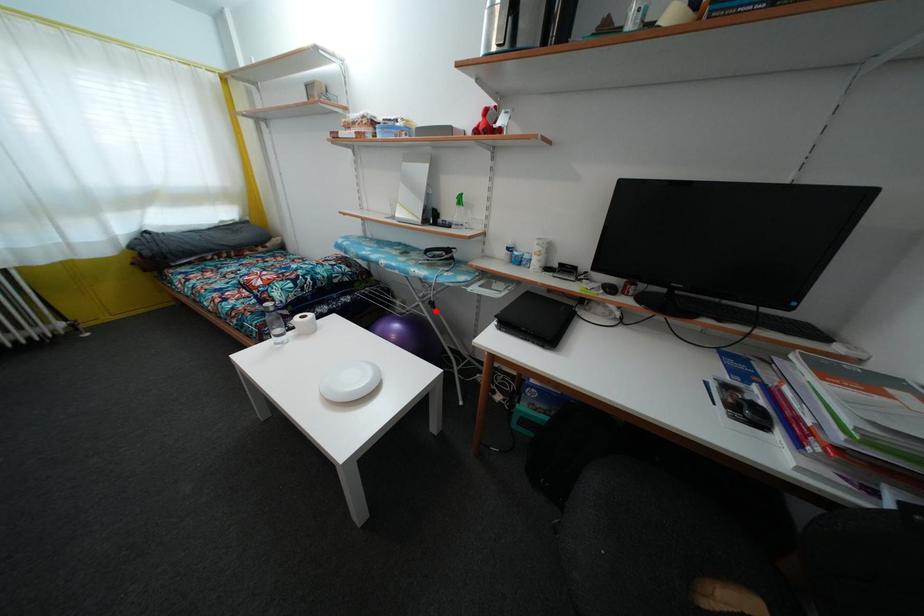
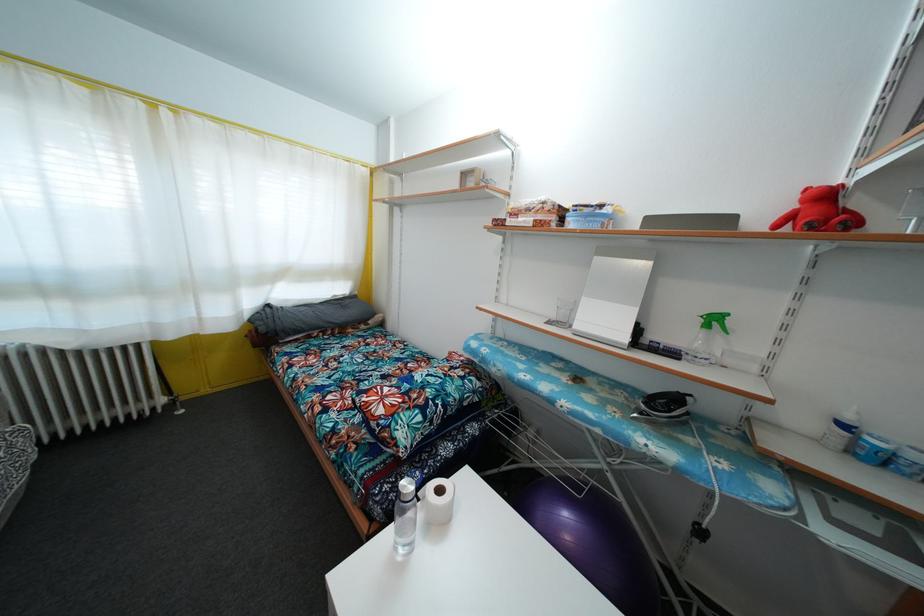
Locate, in the second image, the point that corresponds to the highlighted location in the first image.

(704, 540)